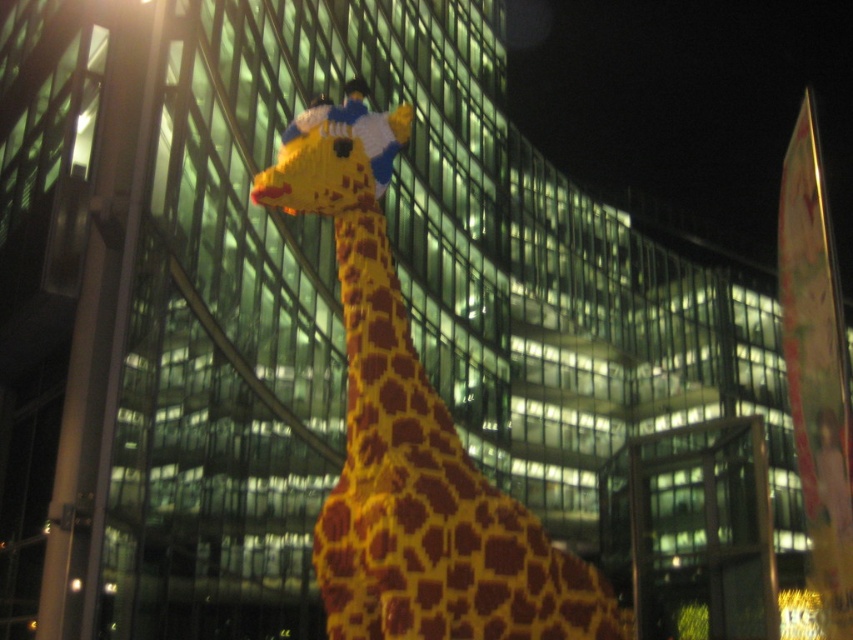
You are an artist planning to create a miniature version of the scene. You need to decide which object between the yellow matte giraffe at center and the metallic pole at left should be scaled down more to maintain the original scene proportions. Which one should you scale down more?

The yellow matte giraffe at center is bigger than the metallic pole at left, so to maintain the original proportions, you should scale down the metallic pole at left more than the giraffe.

You are standing in front of the yellow matte giraffe at center and the metallic pole at left. Which object is taller?

The metallic pole at left is taller than the yellow matte giraffe at center.

Consider the image. You are standing in front of the LEGO giraffe sculpture and want to place a small decoration on the point that is closer to you. Which point should you choose between point [434,419] and point [155,40]?

Point [434,419] is in front of point [155,40], so you should choose point [434,419] as it is closer to you.